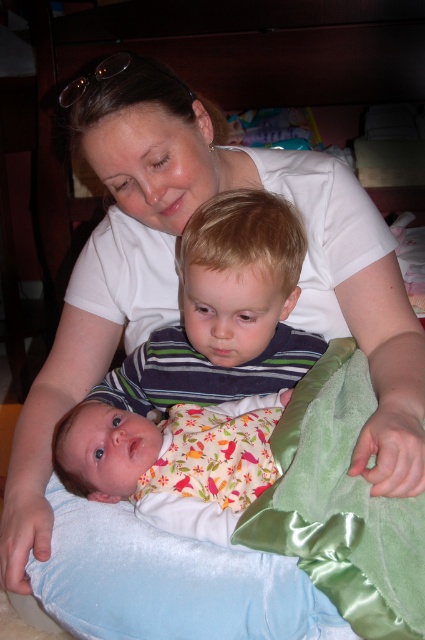
You are a photographer taking a picture of the scene. You notice two points in the image at coordinates point (263, 332) and point (144, 440). Which point is closer to your camera?

Point (263, 332) is further to the viewer than point (144, 440), so the closer point to the camera would be point (144, 440).

You are a photographer setting up for a family photo. You need to ensure that the striped fabric shirt at center and the floral fabric baby at lower left are both visible in the frame. Based on their positions, which object should you focus on first to ensure both are in focus?

The striped fabric shirt at center is taller than the floral fabric baby at lower left. Therefore, focusing on the striped fabric shirt at center first will help ensure both are in focus since it is the taller object.